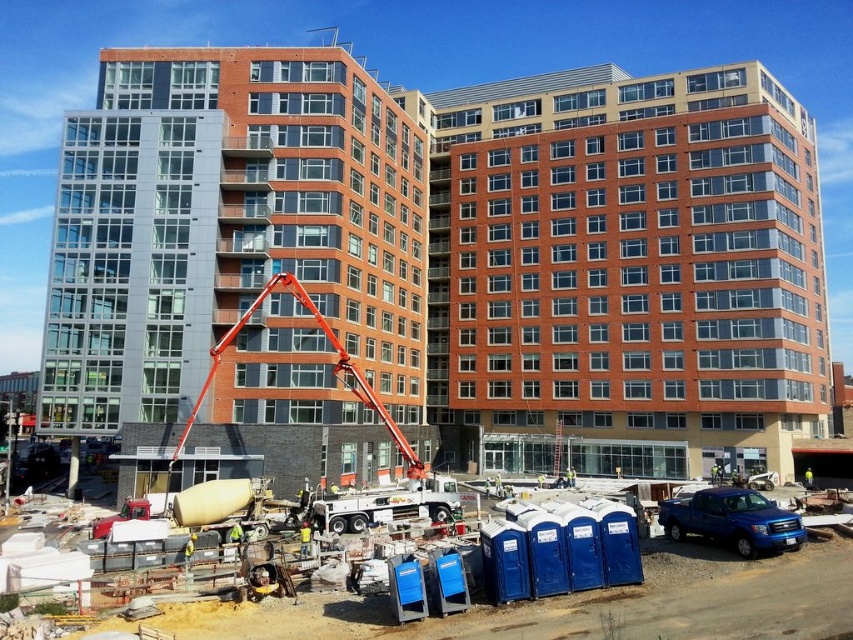
Question: Is matte glass building at center to the left of yellow hard hat at center from the viewer's perspective?

Choices:
 (A) no
 (B) yes

Answer: (B)

Question: Estimate the real-world distances between objects in this image. Which object is farther from the matte glass building at center?

Choices:
 (A) yellow hard hat at center
 (B) shiny blue truck at lower right
 (C) orange metallic crane at center

Answer: (B)

Question: Observing the image, what is the correct spatial positioning of shiny blue truck at lower right in reference to yellow hard hat at center?

Choices:
 (A) above
 (B) below

Answer: (A)

Question: Which point is farther to the camera?

Choices:
 (A) (265, 292)
 (B) (299, 550)

Answer: (A)

Question: Can you confirm if blue plastic port-a-potties at lower center is bigger than shiny blue truck at lower right?

Choices:
 (A) yes
 (B) no

Answer: (B)

Question: Which point is farther from the camera taking this photo?

Choices:
 (A) click(654, 573)
 (B) click(242, 106)
 (C) click(299, 547)
 (D) click(776, 524)

Answer: (B)